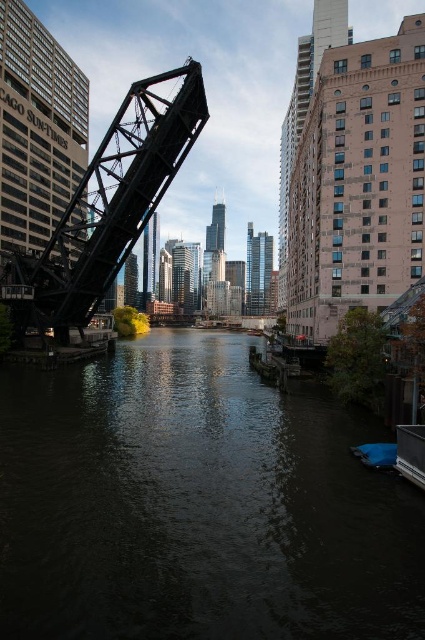
Question: Which of the following is the farthest from the observer?

Choices:
 (A) blue fabric boat at lower right
 (B) black steel bridge at left

Answer: (B)

Question: Is dark water at center below blue fabric boat at lower right?

Choices:
 (A) no
 (B) yes

Answer: (A)

Question: Does dark water at center appear on the right side of blue fabric boat at lower right?

Choices:
 (A) yes
 (B) no

Answer: (B)

Question: Which point appears farthest from the camera in this image?

Choices:
 (A) (379, 442)
 (B) (116, 152)
 (C) (175, 525)

Answer: (B)

Question: Is black steel bridge at left to the left of blue fabric boat at lower right from the viewer's perspective?

Choices:
 (A) yes
 (B) no

Answer: (A)

Question: Which object is the farthest from the blue fabric boat at lower right?

Choices:
 (A) black steel bridge at left
 (B) dark water at center

Answer: (A)